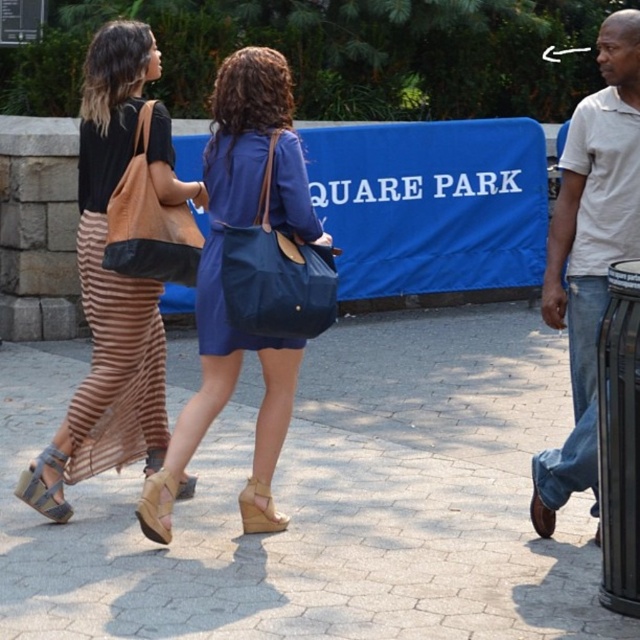
You are standing at the point marked by the camera. Which of the two points, point (96, 168) or point (260, 189), is farther away from you?

Point (96, 168) is behind point (260, 189), so it is farther away from you.

You are a photographer trying to capture a photo of the matte brown skirt at left and the blue fabric bag at center. Since the lighting is bright, you want to avoid shadows from overlapping. Which object should you position closer to the light source to prevent its shadow from covering the other?

The matte brown skirt at left is positioned under the blue fabric bag at center. To prevent the shadow of one object from covering the other, position the blue fabric bag at center closer to the light source so its shadow falls away from the matte brown skirt at left.

You are standing in the outdoor scene and want to walk from point A to point B. Point A is at coordinates point [506,509] and point B is at coordinates point [627,176]. Since you are facing the scene, which direction should you walk to move from point A to point B?

Point [506,509] is closer to you than point [627,176]. To move from point A to point B, you should walk away from yourself towards the direction of the point that is further away.